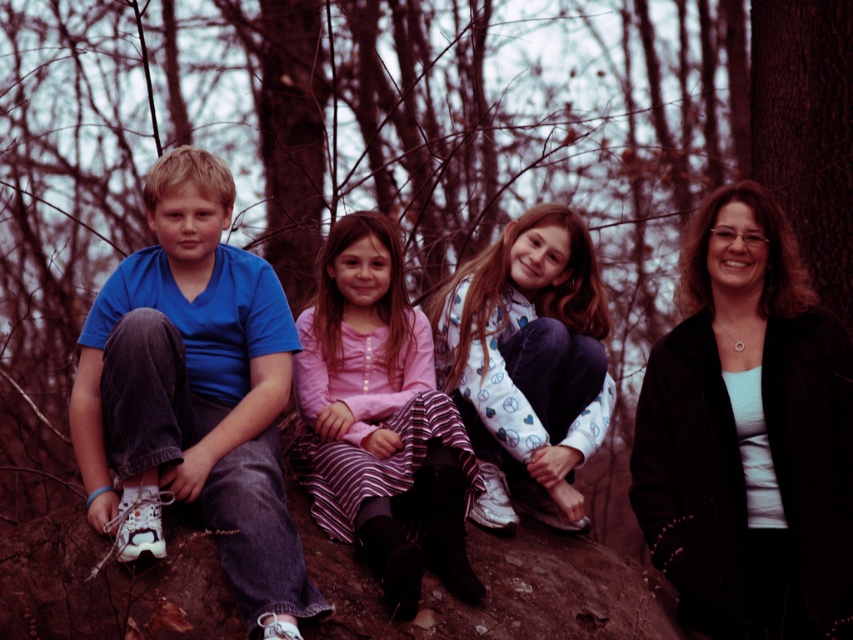
Question: Does black matte jacket at upper right come in front of matte blue t-shirt at left?

Choices:
 (A) yes
 (B) no

Answer: (B)

Question: Among these objects, which one is nearest to the camera?

Choices:
 (A) matte blue t-shirt at left
 (B) pink fabric dress at center
 (C) white fleece jacket at center
 (D) black matte jacket at upper right

Answer: (A)

Question: Does black matte jacket at upper right have a lesser width compared to matte blue t-shirt at left?

Choices:
 (A) yes
 (B) no

Answer: (B)

Question: Is matte blue t-shirt at left to the left of white fleece jacket at center from the viewer's perspective?

Choices:
 (A) no
 (B) yes

Answer: (B)

Question: Considering the real-world distances, which object is closest to the pink fabric dress at center?

Choices:
 (A) black matte jacket at upper right
 (B) matte blue t-shirt at left
 (C) white fleece jacket at center

Answer: (C)

Question: Which point is closer to the camera?

Choices:
 (A) (828, 531)
 (B) (155, 548)

Answer: (B)